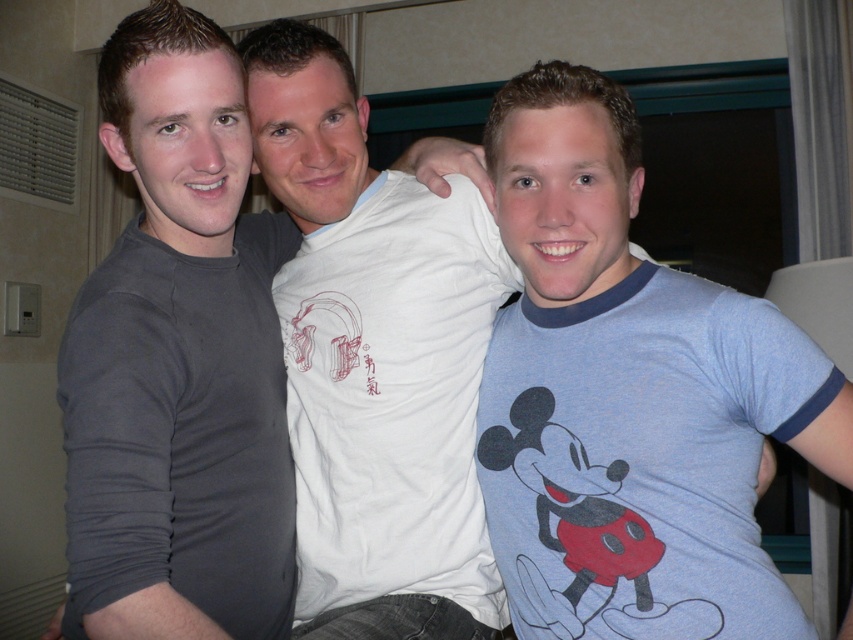
You are taking a photo of two points in the scene. The first point is at coordinate point (508, 506) and the second is at point (456, 332). Which point is closer to the camera?

Point (508, 506) is closer to the camera than point (456, 332).

You are standing in the room and want to locate the point at coordinates (630, 396). Based on the scene description, which object does this point lie on?

The point at coordinates (630, 396) lies on the blue heathered t shirt at center.

You are standing at the point marked by the coordinates point (337,134). You want to move to the door located at the opposite side of the room. The minimum distance you need to move is 10 feet. Can you reach the door without crossing the 10 feet distance?

The minimum distance you need to move is 10 feet, but the distance between you and the door is not provided in the scene description. Therefore, it is impossible to determine if you can reach the door without crossing the 10 feet distance based on the given information.